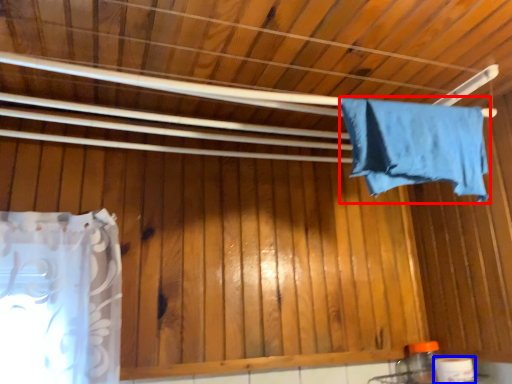
Question: Which point is closer to the camera, towel (highlighted by a red box) or toilet paper (highlighted by a blue box)?

Choices:
 (A) towel
 (B) toilet paper

Answer: (A)